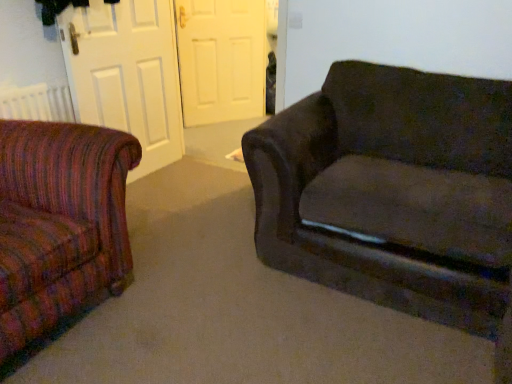
What are the coordinates of `white matte door at center, placed as the 1th screen door when sorted from back to front` in the screenshot? It's located at (221, 59).

Describe the element at coordinates (127, 74) in the screenshot. This screenshot has height=384, width=512. I see `matte white door at left, which ranks as the 1th screen door in front-to-back order` at that location.

Find the location of `white matte door at center, placed as the 1th screen door when sorted from back to front`. white matte door at center, placed as the 1th screen door when sorted from back to front is located at coordinates (221, 59).

What's the angular difference between white matte door at center, placed as the 1th screen door when sorted from back to front, and dark fabric couch at right's facing directions?

The angular difference between white matte door at center, placed as the 1th screen door when sorted from back to front, and dark fabric couch at right is 54.2 degrees.

Is dark fabric couch at right a part of white matte door at center, placed as the 1th screen door when sorted from back to front?

Actually, dark fabric couch at right is outside white matte door at center, placed as the 1th screen door when sorted from back to front.

Which is behind, point (200, 50) or point (379, 287)?

Positioned behind is point (200, 50).

In the scene shown: From the image's perspective, which one is positioned lower, white matte door at center, placed as the 1th screen door when sorted from back to front, or dark fabric couch at right?

dark fabric couch at right.

Does white matte door at center, which appears as the second screen door when viewed from the front, have a lesser width compared to matte white door at left, which is the second screen door from back to front?

Incorrect, the width of white matte door at center, which appears as the second screen door when viewed from the front, is not less than that of matte white door at left, which is the second screen door from back to front.

Does point (200, 25) lie in front of point (122, 31)?

No, it is behind (122, 31).

Considering the positions of objects white matte door at center, placed as the 1th screen door when sorted from back to front, and matte white door at left, which ranks as the 1th screen door in front-to-back order, in the image provided, who is more to the left, white matte door at center, placed as the 1th screen door when sorted from back to front, or matte white door at left, which ranks as the 1th screen door in front-to-back order,?

matte white door at left, which ranks as the 1th screen door in front-to-back order.

From a real-world perspective, is dark fabric couch at right physically below white matte door at center, placed as the 1th screen door when sorted from back to front?

Yes, from a real-world perspective, dark fabric couch at right is below white matte door at center, placed as the 1th screen door when sorted from back to front.

Is dark fabric couch at right inside the boundaries of white matte door at center, which appears as the second screen door when viewed from the front, or outside?

dark fabric couch at right is not inside white matte door at center, which appears as the second screen door when viewed from the front, it's outside.

Is point (386, 290) less distant than point (187, 75)?

Yes, point (386, 290) is closer to viewer.

From the dark fabric couch at right, count 2nd screen doors backward and point to it. Please provide its 2D coordinates.

[(221, 59)]

I want to click on studio couch on the right of the matte white door at left, which ranks as the 1th screen door in front-to-back order, so click(x=392, y=191).

From a real-world perspective, is dark fabric couch at right positioned over matte white door at left, which is the second screen door from back to front, based on gravity?

No, from a real-world perspective, dark fabric couch at right is not above matte white door at left, which is the second screen door from back to front.

Which object is positioned more to the left, dark fabric couch at right or matte white door at left, which ranks as the 1th screen door in front-to-back order?

From the viewer's perspective, matte white door at left, which ranks as the 1th screen door in front-to-back order, appears more on the left side.

From the image's perspective, which one is positioned lower, dark fabric couch at right or matte white door at left, which ranks as the 1th screen door in front-to-back order?

dark fabric couch at right is shown below in the image.

Which is behind, point (140, 57) or point (224, 101)?

The point (224, 101) is more distant.

Between matte white door at left, which ranks as the 1th screen door in front-to-back order, and white matte door at center, placed as the 1th screen door when sorted from back to front, which one is positioned in front?

Positioned in front is matte white door at left, which ranks as the 1th screen door in front-to-back order.

Is matte white door at left, which is the second screen door from back to front, facing away from white matte door at center, which appears as the second screen door when viewed from the front?

matte white door at left, which is the second screen door from back to front, does not have its back to white matte door at center, which appears as the second screen door when viewed from the front.

From a real-world perspective, is matte white door at left, which ranks as the 1th screen door in front-to-back order, physically located above or below white matte door at center, which appears as the second screen door when viewed from the front?

In terms of real-world spatial position, matte white door at left, which ranks as the 1th screen door in front-to-back order, is above white matte door at center, which appears as the second screen door when viewed from the front.

Based on their sizes in the image, would you say matte white door at left, which ranks as the 1th screen door in front-to-back order, is bigger or smaller than dark fabric couch at right?

Clearly, matte white door at left, which ranks as the 1th screen door in front-to-back order, is smaller in size than dark fabric couch at right.

What's the angular difference between matte white door at left, which is the second screen door from back to front, and dark fabric couch at right's facing directions?

There is a 84.1-degree angle between the facing directions of matte white door at left, which is the second screen door from back to front, and dark fabric couch at right.

Looking at this image, from their relative heights in the image, would you say matte white door at left, which ranks as the 1th screen door in front-to-back order, is taller or shorter than dark fabric couch at right?

In the image, matte white door at left, which ranks as the 1th screen door in front-to-back order, appears to be taller than dark fabric couch at right.

Considering the sizes of objects matte white door at left, which is the second screen door from back to front, and dark fabric couch at right in the image provided, who is wider, matte white door at left, which is the second screen door from back to front, or dark fabric couch at right?

With larger width is dark fabric couch at right.

From a real-world perspective, starting from the dark fabric couch at right, which screen door is the 1st one vertically above it? Please provide its 2D coordinates.

[(221, 59)]

Identify the location of screen door lying below the white matte door at center, placed as the 1th screen door when sorted from back to front (from the image's perspective). This screenshot has width=512, height=384. (127, 74).

Estimate the real-world distances between objects in this image. Which object is further from matte white door at left, which ranks as the 1th screen door in front-to-back order, dark fabric couch at right or white matte door at center, placed as the 1th screen door when sorted from back to front?

dark fabric couch at right is positioned further to the anchor matte white door at left, which ranks as the 1th screen door in front-to-back order.

Which object lies further to the anchor point white matte door at center, placed as the 1th screen door when sorted from back to front, dark fabric couch at right or matte white door at left, which ranks as the 1th screen door in front-to-back order?

dark fabric couch at right.

Considering their positions, is matte white door at left, which is the second screen door from back to front, positioned closer to white matte door at center, placed as the 1th screen door when sorted from back to front, than dark fabric couch at right?

matte white door at left, which is the second screen door from back to front.

Based on their spatial positions, is white matte door at center, placed as the 1th screen door when sorted from back to front, or matte white door at left, which is the second screen door from back to front, further from dark fabric couch at right?

white matte door at center, placed as the 1th screen door when sorted from back to front, is further to dark fabric couch at right.

Looking at the image, which one is located further to dark fabric couch at right, matte white door at left, which ranks as the 1th screen door in front-to-back order, or white matte door at center, placed as the 1th screen door when sorted from back to front?

white matte door at center, placed as the 1th screen door when sorted from back to front, lies further to dark fabric couch at right than the other object.

From the image, which object appears to be farther from matte white door at left, which ranks as the 1th screen door in front-to-back order, white matte door at center, which appears as the second screen door when viewed from the front, or dark fabric couch at right?

dark fabric couch at right.

Locate an element on the screen. screen door between dark fabric couch at right and white matte door at center, placed as the 1th screen door when sorted from back to front, from front to back is located at coordinates (127, 74).